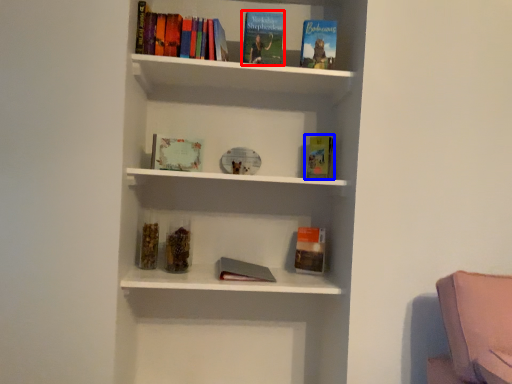
Question: Which point is closer to the camera, book (highlighted by a red box) or paperback book (highlighted by a blue box)?

Choices:
 (A) book
 (B) paperback book

Answer: (A)